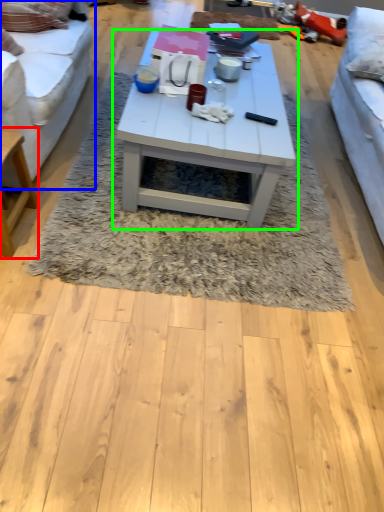
Question: Which is farther away from table (highlighted by a red box)? studio couch (highlighted by a blue box) or coffee table (highlighted by a green box)?

Choices:
 (A) studio couch
 (B) coffee table

Answer: (B)